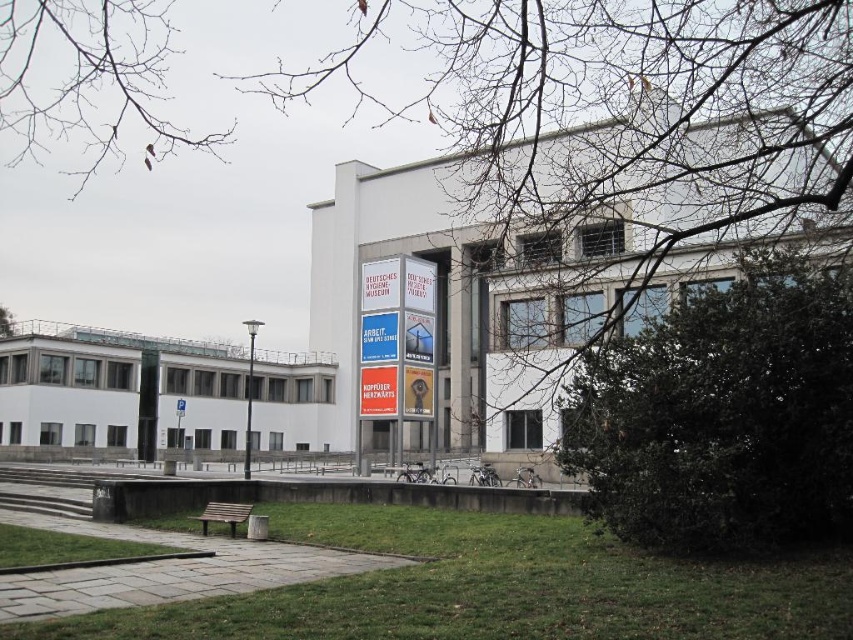
Is point (585, 493) positioned before point (4, 324)?

Yes.

Is dark green leafy bush at center right to the right of green leafy tree at upper left from the viewer's perspective?

Correct, you'll find dark green leafy bush at center right to the right of green leafy tree at upper left.

Who is more forward, (x=769, y=339) or (x=10, y=317)?

Positioned in front is point (x=769, y=339).

Find the location of `dark green leafy bush at center right`. dark green leafy bush at center right is located at coordinates (722, 413).

Consider the image. Measure the distance between point (845, 508) and camera.

The distance of point (845, 508) from camera is 17.30 meters.

Between dark green leafy bush at center right and bare branches at upper left, which one appears on the right side from the viewer's perspective?

dark green leafy bush at center right

Who is more distant from viewer, (828,512) or (57,74)?

The point (57,74) is more distant.

Locate an element on the screen. The image size is (853, 640). dark green leafy bush at center right is located at coordinates (722, 413).

The width and height of the screenshot is (853, 640). I want to click on dark green leafy bush at center right, so click(722, 413).

Which is above, dark green leafy bush at center right or white paper sign at center?

dark green leafy bush at center right

Identify the location of dark green leafy bush at center right. tap(722, 413).